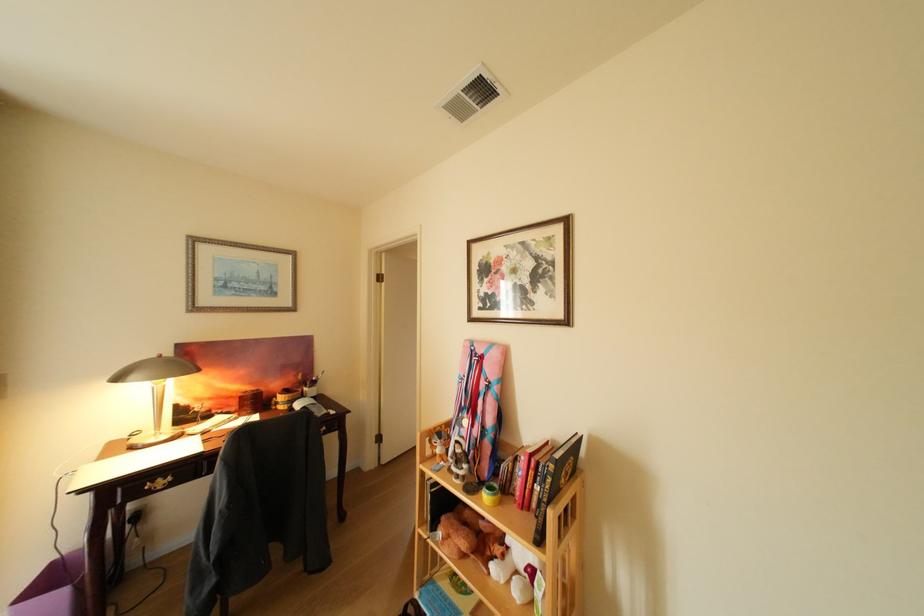
This screenshot has width=924, height=616. What do you see at coordinates (469, 536) in the screenshot? I see `the brown stuffed animal` at bounding box center [469, 536].